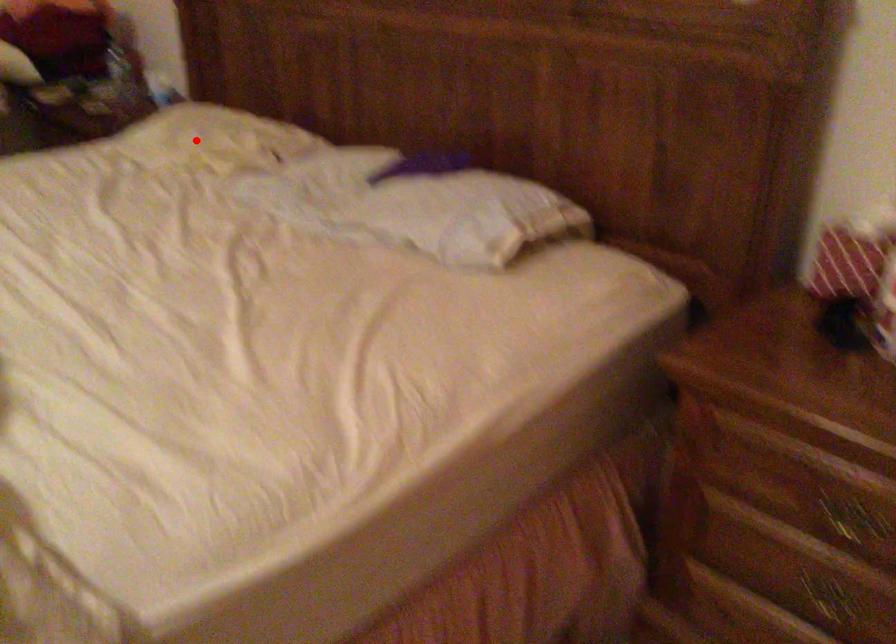
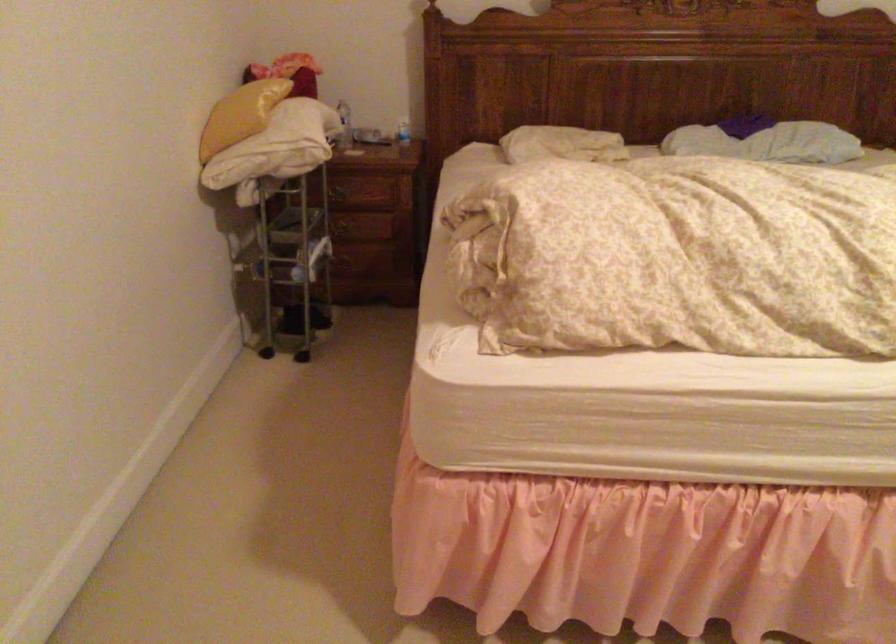
The point at the highlighted location is marked in the first image. Where is the corresponding point in the second image?

(561, 144)